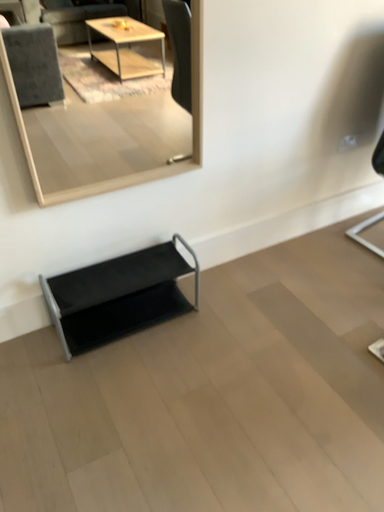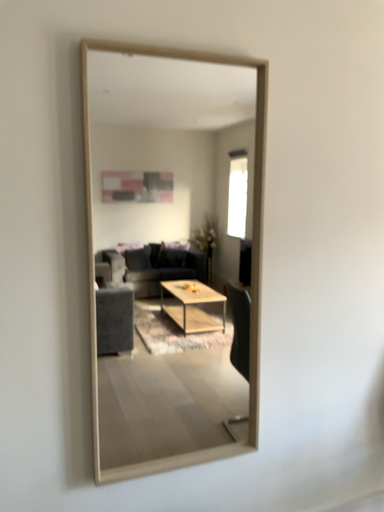
Question: Which way did the camera rotate in the video?

Choices:
 (A) rotated upward
 (B) rotated downward

Answer: (A)